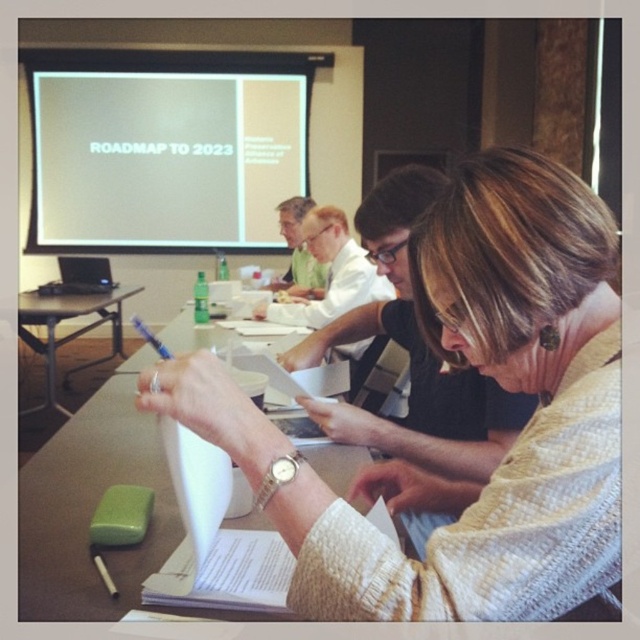
You are an attendee at this meeting and need to present a slide. The projector is currently projecting onto the white matte projector screen at upper left. If you want to point to the matte green shirt at center, which object is wider so you can decide where to stand to have both in view?

The white matte projector screen at upper left might be wider than matte green shirt at center, so you should stand closer to the screen to ensure both are visible.

You are a guest attending a meeting and need to place your bag on the table. Can you put your bag on the green plastic table at left without moving the white knitted sweater at center?

The white knitted sweater at center is positioned under the green plastic table at left, so it is likely placed on the table. Therefore, placing your bag there might displace the sweater.